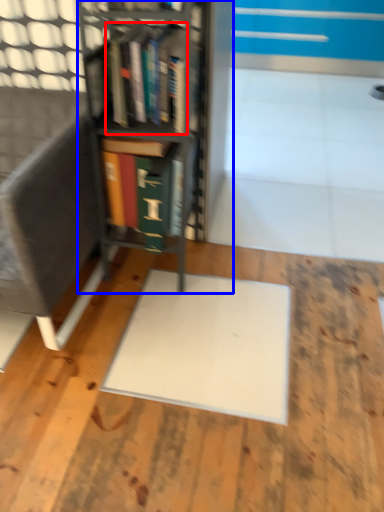
Question: Which point is further to the camera, book (highlighted by a red box) or bookcase (highlighted by a blue box)?

Choices:
 (A) book
 (B) bookcase

Answer: (A)